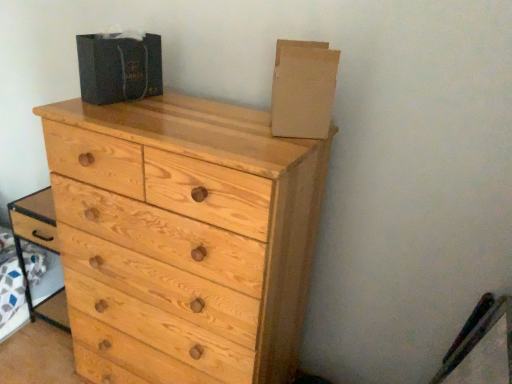
At what (x,y) coordinates should I click in order to perform the action: click on free space in front of cardboard at upper right, placed as the 2th cardboard box when sorted from left to right. Please return your answer as a coordinate pair (x, y). The height and width of the screenshot is (384, 512). Looking at the image, I should click on (268, 140).